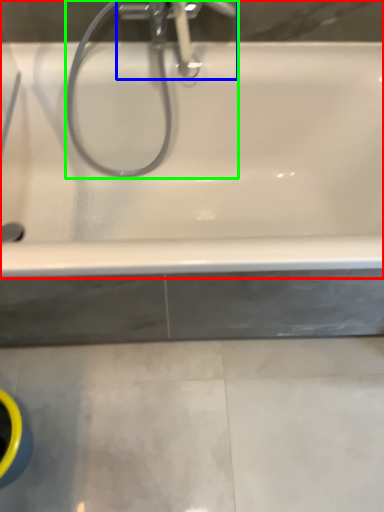
Question: Which is nearer to the bathtub (highlighted by a red box)? tap (highlighted by a blue box) or plumbing fixture (highlighted by a green box).

Choices:
 (A) tap
 (B) plumbing fixture

Answer: (B)